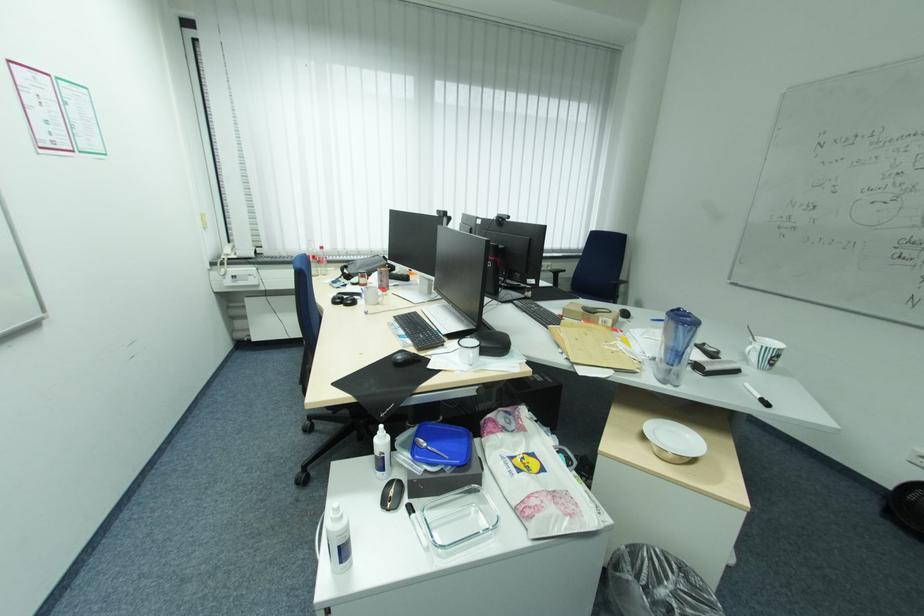
Find where to lift the plastic soda bottle. Please return your answer as a coordinate pair (x, y).

(382, 453)